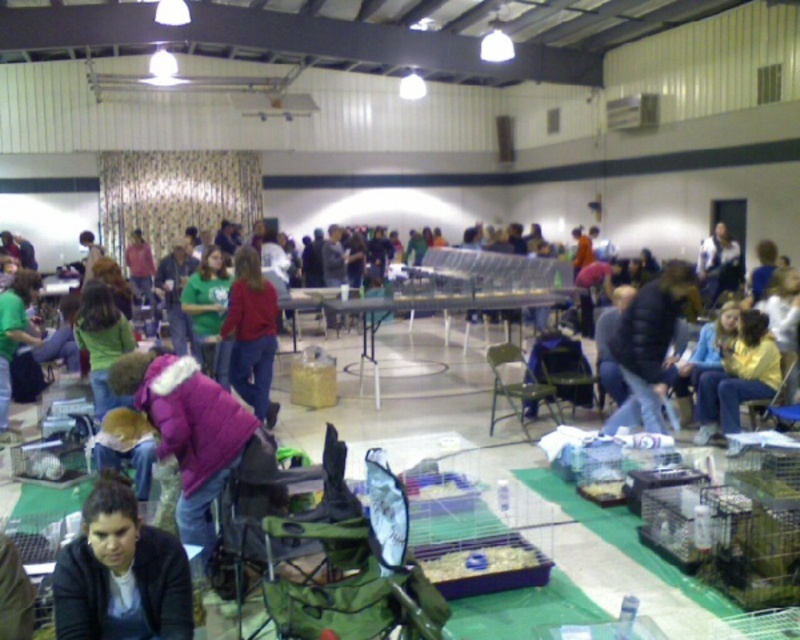
You are standing in the gymnasium and want to take a photo of both the point at (212, 493) and the point at (2, 410). Which point should you focus on first to ensure both are in sharp focus?

You should focus on the point at (2, 410) first because it is farther from the camera, and focusing on the farther point will ensure the closer point at (212, 493) is also in focus.

You are a photographer setting up a shoot in the gymnasium. You have a purple fuzzy coat at center and a white plastic table at center. Where should you place your camera to capture both items in the same frame?

To capture both the purple fuzzy coat at center and the white plastic table at center in the same frame, position the camera so it can see the purple fuzzy coat at center under the white plastic table at center.

You are standing in the gymnasium and see the purple fuzzy coat at center and the white plastic table at center. Which object is nearer to you?

The purple fuzzy coat at center is closer to the viewer than the white plastic table at center.